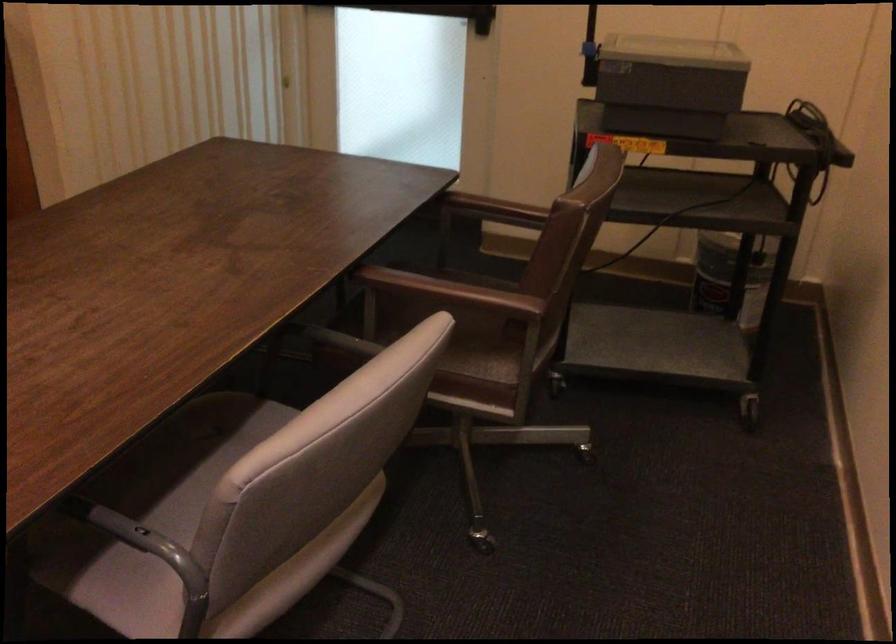
This screenshot has height=644, width=896. What are the coordinates of `door push bar` in the screenshot? It's located at (437, 12).